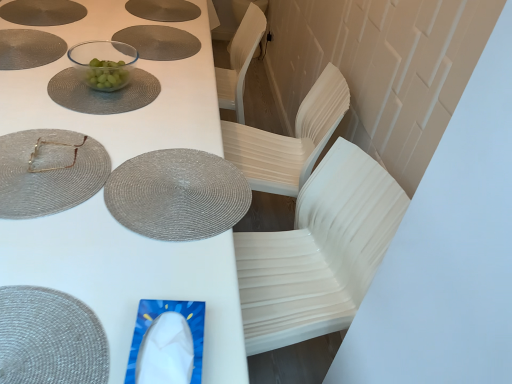
The image size is (512, 384). Find the location of `free space between matte woven placemat at upper left, marked as the 1th glass plate in a front-to-back arrangement, and transparent glass bowl at upper center, the first glass plate in the back-to-front sequence`. free space between matte woven placemat at upper left, marked as the 1th glass plate in a front-to-back arrangement, and transparent glass bowl at upper center, the first glass plate in the back-to-front sequence is located at coordinates (81, 120).